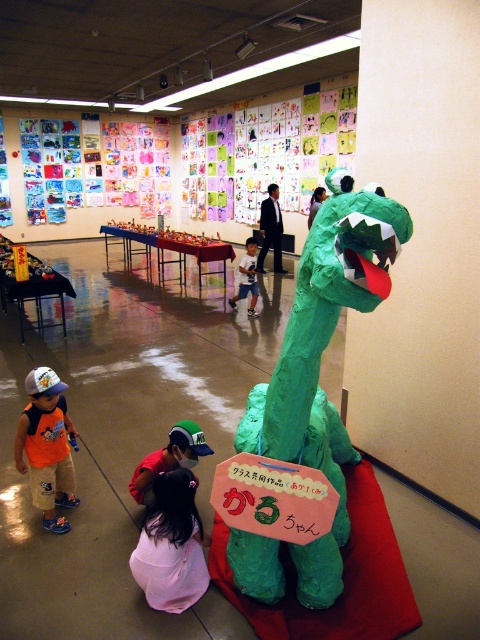
Which is below, orange cotton shirt at lower left or light blue fabric shirt at center?

orange cotton shirt at lower left is below.

The height and width of the screenshot is (640, 480). I want to click on orange cotton shirt at lower left, so click(x=47, y=445).

Does green papier-mâché dinosaur at center have a smaller size compared to orange cotton shirt at lower left?

No.

Is green papier-mâché dinosaur at center taller than orange cotton shirt at lower left?

Yes, green papier-mâché dinosaur at center is taller than orange cotton shirt at lower left.

Identify the location of green papier-mâché dinosaur at center. This screenshot has width=480, height=640. (320, 360).

This screenshot has height=640, width=480. I want to click on green papier-mâché dinosaur at center, so click(x=320, y=360).

Is orange cotton shirt at lower left wider than reddish-orange fabric at lower center?

In fact, orange cotton shirt at lower left might be narrower than reddish-orange fabric at lower center.

Between orange cotton shirt at lower left and reddish-orange fabric at lower center, which one is positioned lower?

reddish-orange fabric at lower center is lower down.

Who is more distant from viewer, (x=33, y=480) or (x=190, y=467)?

Positioned behind is point (x=190, y=467).

Identify the location of orange cotton shirt at lower left. (47, 445).